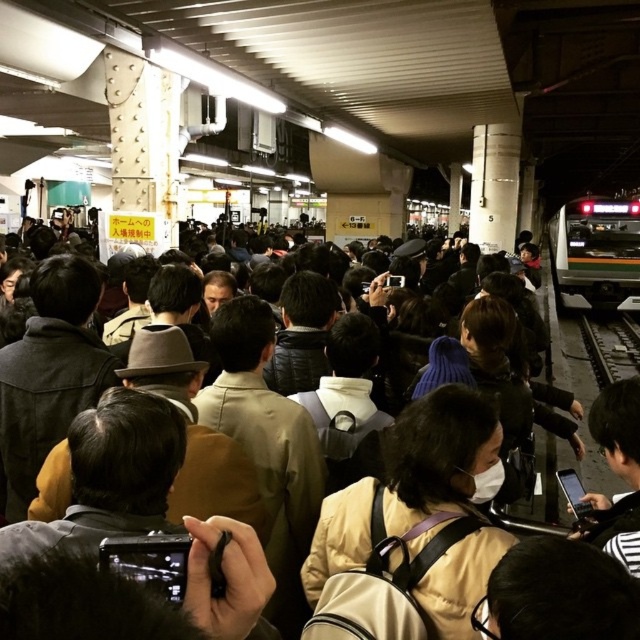
You are standing on a busy train station platform during rush hour. You see a beige fabric backpack at center. Can you estimate its location using coordinates?

The beige fabric backpack at center is located at coordinates point (412, 529).

You are standing on the train station platform and want to board the green matte train at right. However, there are many people blocking your path. Can you see the black metal train track at right from your current position?

Yes, because the green matte train at right is further to the viewer than the black metal train track at right, so the track is behind the train and might be partially visible between or around the people.

You are standing at the camera position and want to reach the point at coordinates (499, 472). If you walk straight ahead, how far will you have to walk to reach that point?

The point at coordinates (499, 472) is 2.03 meters away from the camera, so you will have to walk 2.03 meters straight ahead to reach it.